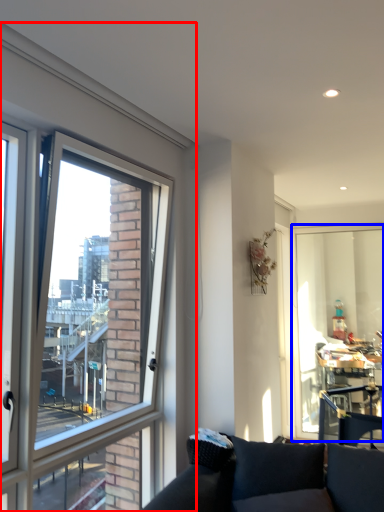
Question: Which of the following is the closest to the observer, window (highlighted by a red box) or window screen (highlighted by a blue box)?

Choices:
 (A) window
 (B) window screen

Answer: (A)